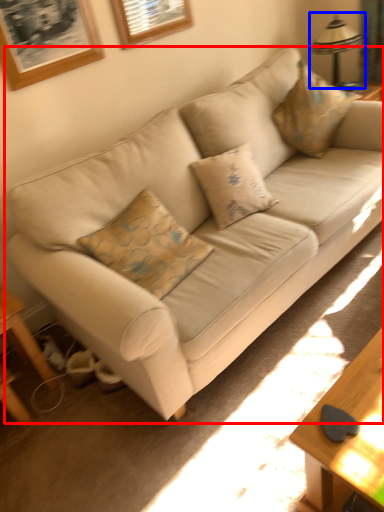
Question: Which of the following is the farthest to the observer, studio couch (highlighted by a red box) or table lamp (highlighted by a blue box)?

Choices:
 (A) studio couch
 (B) table lamp

Answer: (B)